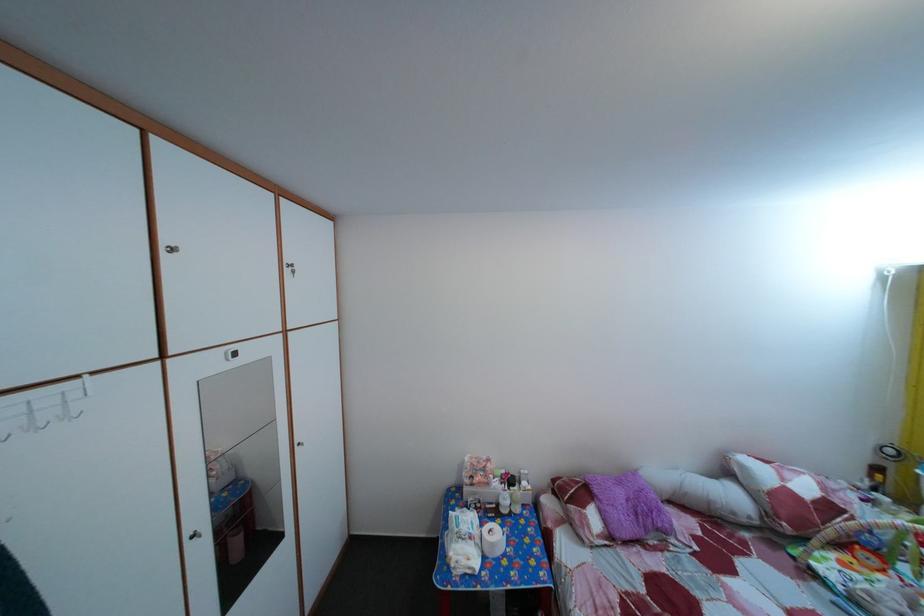
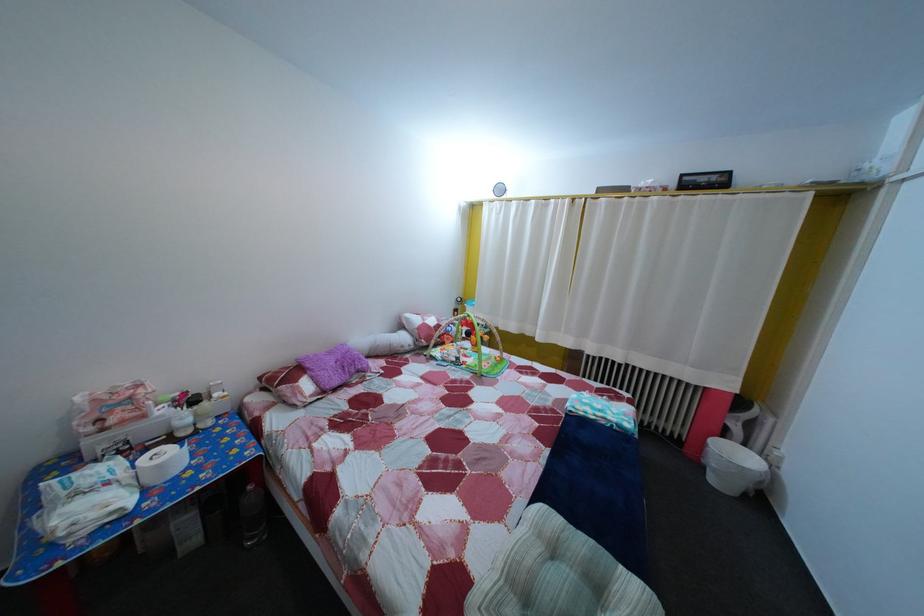
Question: The camera is either moving clockwise (left) or counter-clockwise (right) around the object. The first image is from the beginning of the video and the second image is from the end. Is the camera moving left or right when shooting the video?

Choices:
 (A) Left
 (B) Right

Answer: (A)